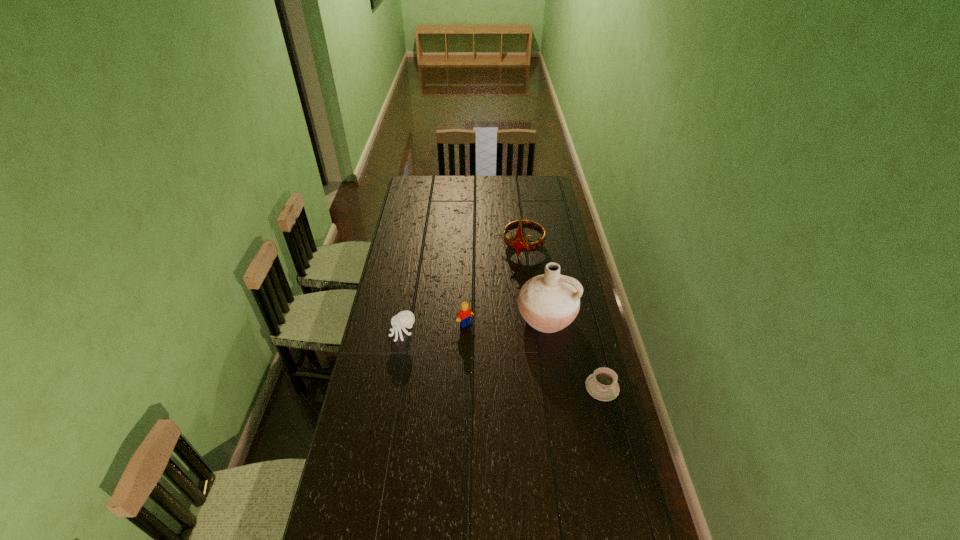
Where is `object present at the left edge`? object present at the left edge is located at coordinates (405, 319).

Find the location of `teacup that is at the right edge`. teacup that is at the right edge is located at coordinates (602, 385).

Image resolution: width=960 pixels, height=540 pixels. I want to click on tiara situated at the right edge, so click(x=518, y=243).

Where is `pottery that is positioned at the right edge`? pottery that is positioned at the right edge is located at coordinates coord(550,302).

The width and height of the screenshot is (960, 540). What are the coordinates of `vacant space at the far edge` in the screenshot? It's located at (515, 190).

The height and width of the screenshot is (540, 960). Identify the location of vacant space at the near edge of the desktop. click(395, 508).

The height and width of the screenshot is (540, 960). What are the coordinates of `vacant area at the left edge` in the screenshot? It's located at (402, 230).

In the image, there is a desktop. Identify the location of vacant space at the right edge. This screenshot has width=960, height=540. (538, 235).

You are a GUI agent. You are given a task and a screenshot of the screen. Output one action in this format:
    pyautogui.click(x=<x>, y=<y>)
    Task: Click on the free space between the teacup and the Lego
    This screenshot has width=960, height=540.
    Given the screenshot: What is the action you would take?
    pyautogui.click(x=534, y=356)

Locate an element on the screen. Image resolution: width=960 pixels, height=540 pixels. free area in between the octopus and the Lego is located at coordinates (434, 329).